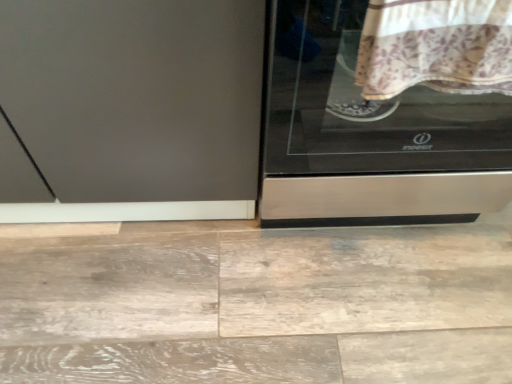
Question: Is stainless steel cooktop at right smaller than floral cotton blanket at upper right?

Choices:
 (A) yes
 (B) no

Answer: (B)

Question: Does stainless steel cooktop at right have a lesser width compared to floral cotton blanket at upper right?

Choices:
 (A) no
 (B) yes

Answer: (A)

Question: Considering the relative sizes of stainless steel cooktop at right and floral cotton blanket at upper right in the image provided, is stainless steel cooktop at right wider than floral cotton blanket at upper right?

Choices:
 (A) yes
 (B) no

Answer: (A)

Question: Is stainless steel cooktop at right positioned far away from floral cotton blanket at upper right?

Choices:
 (A) yes
 (B) no

Answer: (B)

Question: Is stainless steel cooktop at right behind floral cotton blanket at upper right?

Choices:
 (A) yes
 (B) no

Answer: (A)

Question: Is stainless steel cooktop at right bigger than floral cotton blanket at upper right?

Choices:
 (A) no
 (B) yes

Answer: (B)

Question: Are matte gray screen door at left and stainless steel cooktop at right far apart?

Choices:
 (A) no
 (B) yes

Answer: (A)

Question: Is matte gray screen door at left positioned behind stainless steel cooktop at right?

Choices:
 (A) no
 (B) yes

Answer: (B)

Question: Does matte gray screen door at left have a greater height compared to stainless steel cooktop at right?

Choices:
 (A) no
 (B) yes

Answer: (A)

Question: Does matte gray screen door at left have a lesser height compared to stainless steel cooktop at right?

Choices:
 (A) no
 (B) yes

Answer: (B)

Question: Can you confirm if matte gray screen door at left is smaller than stainless steel cooktop at right?

Choices:
 (A) no
 (B) yes

Answer: (A)

Question: Is matte gray screen door at left wider than stainless steel cooktop at right?

Choices:
 (A) yes
 (B) no

Answer: (B)

Question: Is matte gray screen door at left completely or partially inside stainless steel cooktop at right?

Choices:
 (A) no
 (B) yes

Answer: (A)